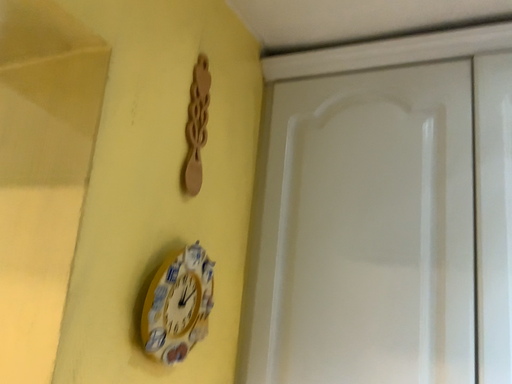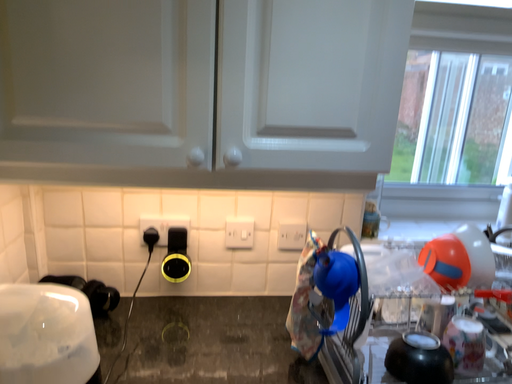
Question: Which way did the camera rotate in the video?

Choices:
 (A) rotated left
 (B) rotated right

Answer: (B)